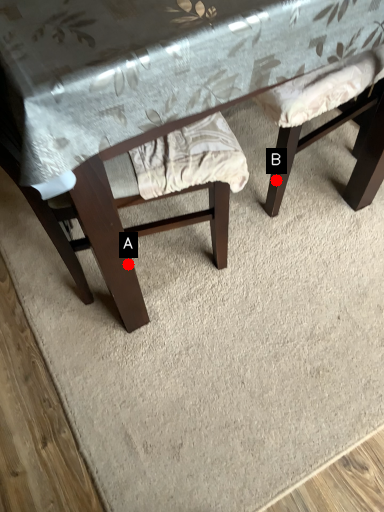
Question: Two points are circled on the image, labeled by A and B beside each circle. Among these points, which one is farthest from the camera?

Choices:
 (A) A is further
 (B) B is further

Answer: (B)